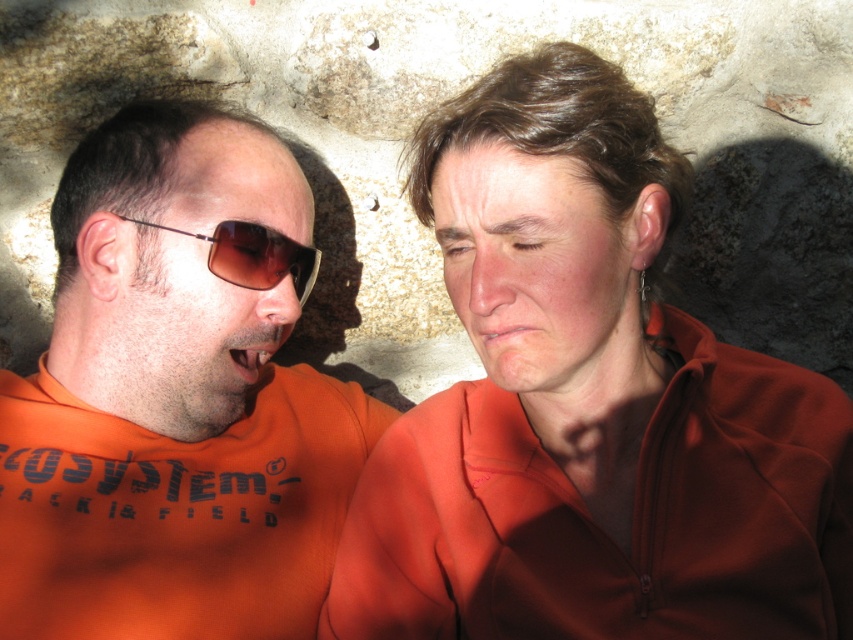
Is point (225, 365) closer to camera compared to point (497, 326)?

No, it is not.

Is the position of matte orange teeth at center more distant than that of dry matte lips at center?

Yes, matte orange teeth at center is further from the viewer.

Find the location of a particular element. Image resolution: width=853 pixels, height=640 pixels. matte orange teeth at center is located at coordinates (248, 353).

In order to click on matte orange sunglasses at left in this screenshot , I will do `click(190, 285)`.

Which is in front, point (196, 285) or point (476, 333)?

Point (476, 333) is more forward.

What do you see at coordinates (190, 285) in the screenshot? I see `matte orange sunglasses at left` at bounding box center [190, 285].

The width and height of the screenshot is (853, 640). Find the location of `matte orange sunglasses at left`. matte orange sunglasses at left is located at coordinates (190, 285).

Who is positioned more to the right, matte orange jacket at center or matte orange sunglasses at left?

From the viewer's perspective, matte orange jacket at center appears more on the right side.

Which is below, matte orange jacket at center or matte orange sunglasses at left?

matte orange jacket at center

Between point (625, 602) and point (193, 202), which one is positioned in front?

Point (625, 602) is in front.

Where is `matte orange jacket at center`? The image size is (853, 640). matte orange jacket at center is located at coordinates (589, 404).